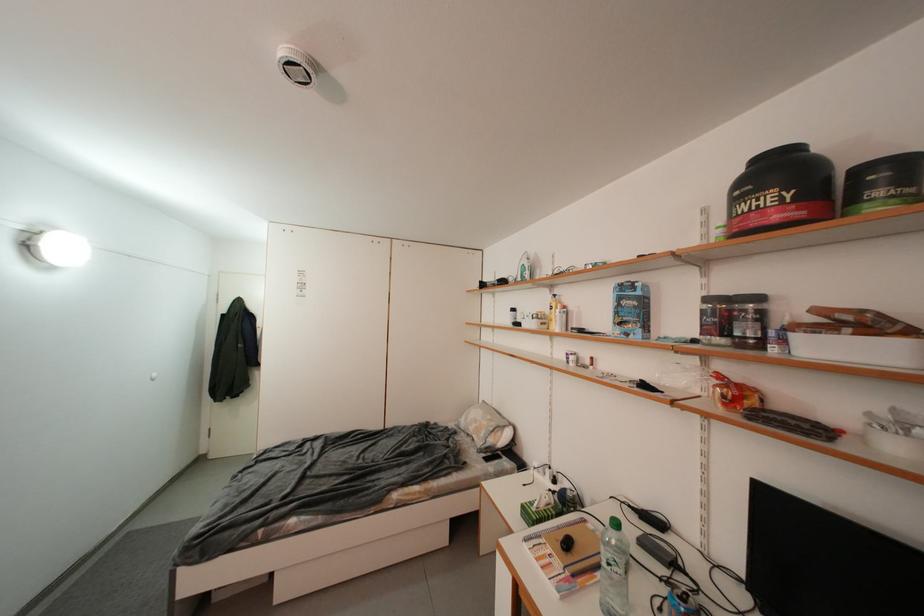
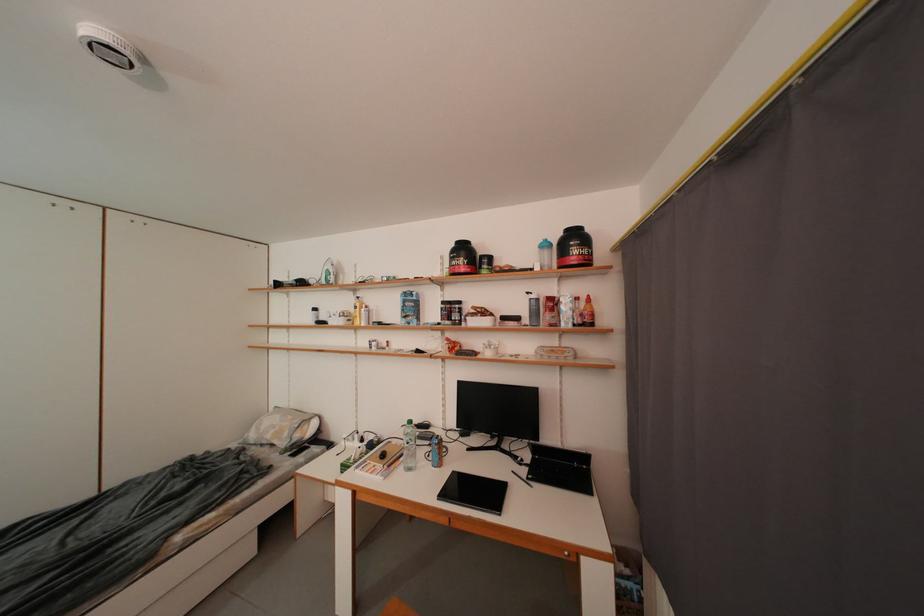
In the second image, find the point that corresponds to point (490, 437) in the first image.

(294, 438)